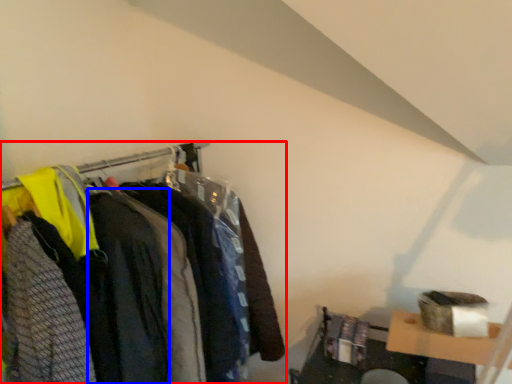
Question: Among these objects, which one is farthest to the camera, closet (highlighted by a red box) or clothing (highlighted by a blue box)?

Choices:
 (A) closet
 (B) clothing

Answer: (B)